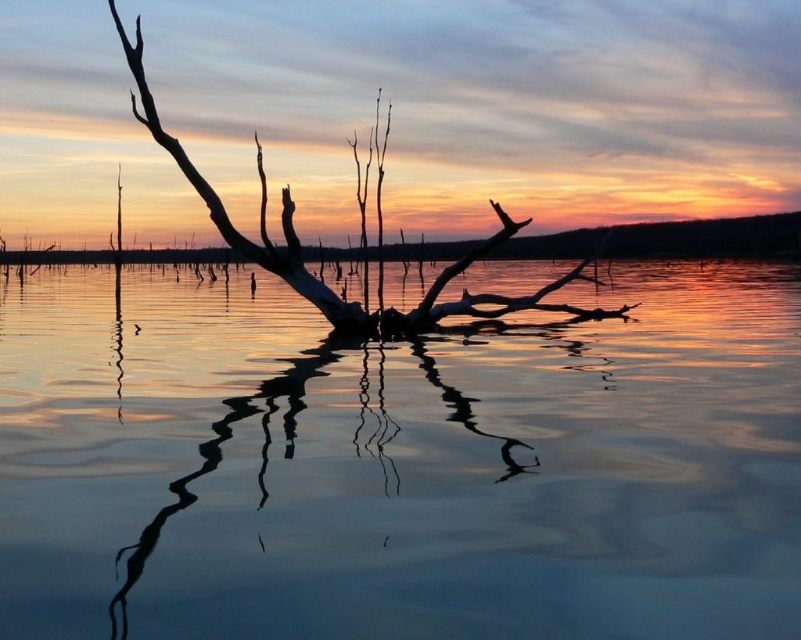
Between transparent water at center and silvery wood branch at center, which one has less height?

With less height is silvery wood branch at center.

Which is behind, point (107, 435) or point (465, 292)?

Positioned behind is point (465, 292).

Between point (167, 381) and point (349, 324), which one is positioned in front?

Point (167, 381) is in front.

The image size is (801, 640). I want to click on transparent water at center, so click(399, 465).

Is silvery wood branch at center to the right of smooth water reflection at center from the viewer's perspective?

Incorrect, silvery wood branch at center is not on the right side of smooth water reflection at center.

What do you see at coordinates (320, 280) in the screenshot? The height and width of the screenshot is (640, 801). I see `silvery wood branch at center` at bounding box center [320, 280].

The width and height of the screenshot is (801, 640). In order to click on silvery wood branch at center in this screenshot , I will do `click(320, 280)`.

Can you confirm if transparent water at center is thinner than smooth water reflection at center?

No, transparent water at center is not thinner than smooth water reflection at center.

Can you confirm if transparent water at center is wider than smooth water reflection at center?

Correct, the width of transparent water at center exceeds that of smooth water reflection at center.

Is point (647, 461) farther from viewer compared to point (186, 506)?

Yes, point (647, 461) is behind point (186, 506).

Identify the location of transparent water at center. (399, 465).